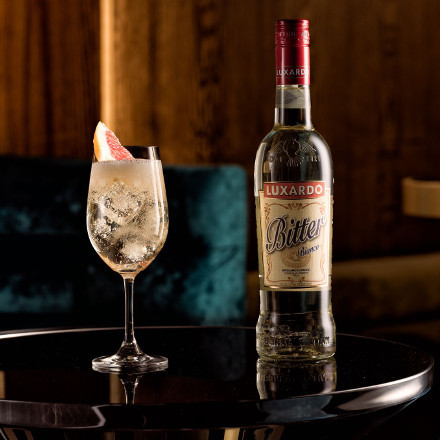
At what (x,y) coordinates should I click in order to perform the action: click on wine glass. Please return your answer as a coordinate pair (x, y). Looking at the image, I should click on (129, 300).